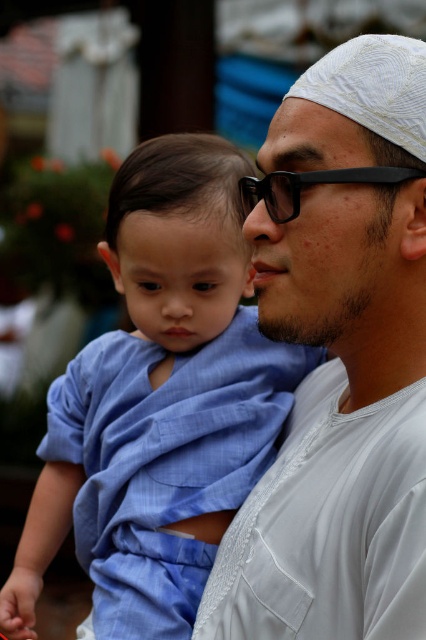
Does point (215, 481) come in front of point (397, 176)?

That is False.

Can you confirm if blue cotton cloth at center is wider than black matte glasses at center?

Yes.

You are a GUI agent. You are given a task and a screenshot of the screen. Output one action in this format:
    pyautogui.click(x=<x>, y=<y>)
    Task: Click on the blue cotton cloth at center
    
    Given the screenshot: What is the action you would take?
    pyautogui.click(x=160, y=401)

Identify the location of blue cotton cloth at center. (160, 401).

Who is lower down, white textured shirt at center or black matte glasses at center?

Positioned lower is white textured shirt at center.

Between point (400, 390) and point (420, 172), which one is positioned in front?

Positioned in front is point (420, 172).

The height and width of the screenshot is (640, 426). In order to click on white textured shirt at center in this screenshot , I will do `click(339, 360)`.

Can you confirm if white textured shirt at center is bigger than blue cotton cloth at center?

Correct, white textured shirt at center is larger in size than blue cotton cloth at center.

Measure the distance between white textured shirt at center and blue cotton cloth at center.

15.40 inches

Is point (416, 316) positioned after point (62, 492)?

No, (416, 316) is in front of (62, 492).

This screenshot has height=640, width=426. Find the location of `white textured shirt at center`. white textured shirt at center is located at coordinates (339, 360).